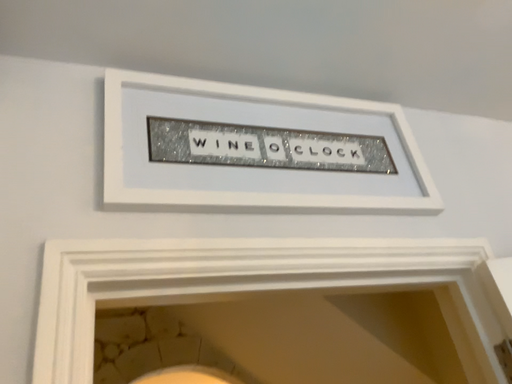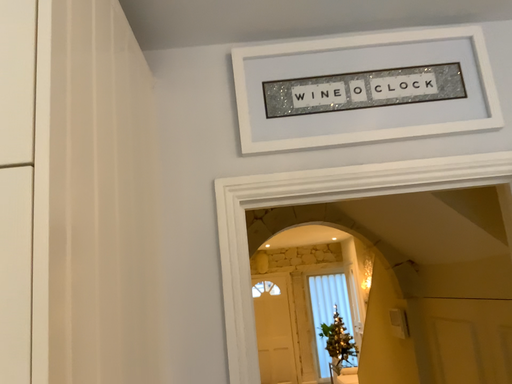
Question: Which way did the camera rotate in the video?

Choices:
 (A) rotated downward
 (B) rotated upward

Answer: (A)